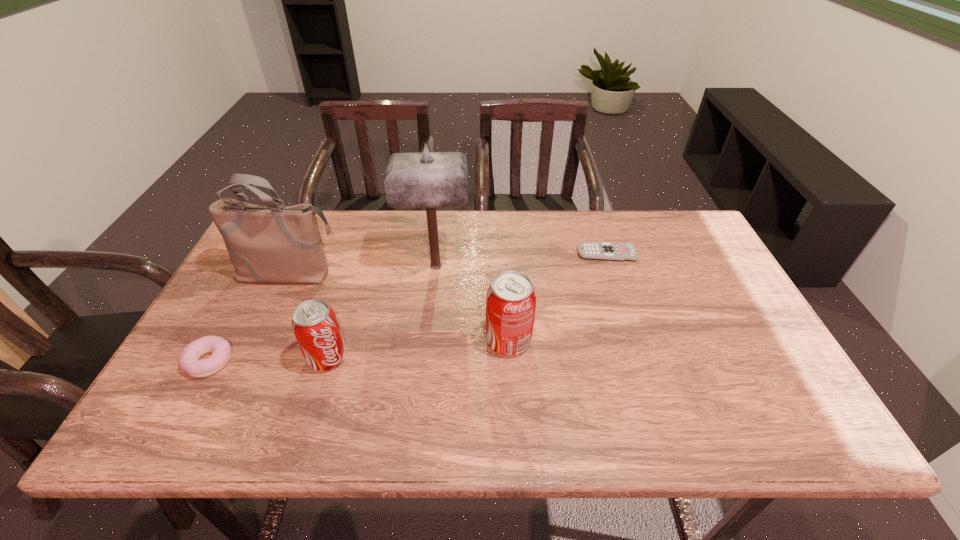
Please point out where to position a new soda on the right to maintain spacing. Please provide its 2D coordinates. Your answer should be formatted as a tuple, i.e. [(x, y)], where the tuple contains the x and y coordinates of a point satisfying the conditions above.

[(677, 326)]